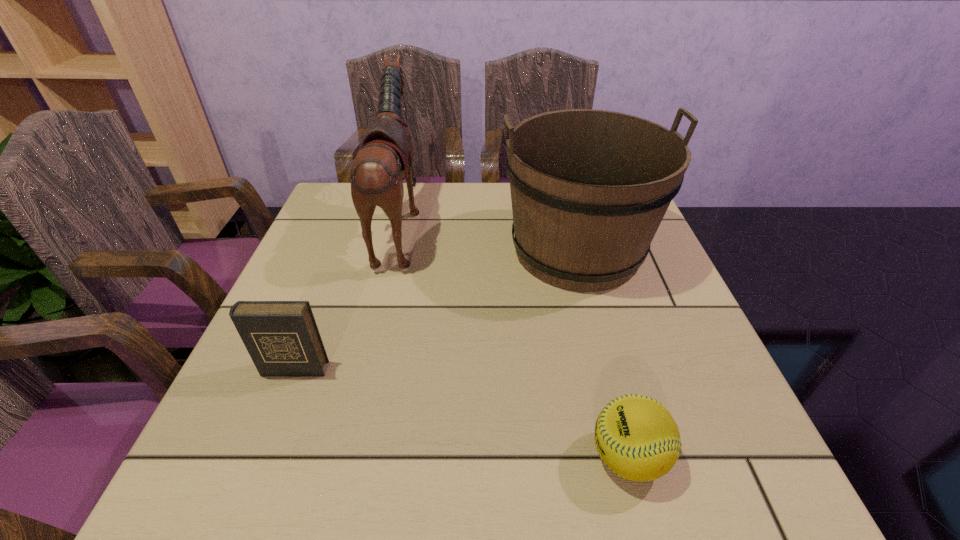
Where is `vacant space at the far edge`? This screenshot has width=960, height=540. vacant space at the far edge is located at coordinates (468, 201).

Identify the location of vacant space at the near edge of the desktop. The image size is (960, 540). point(493,481).

This screenshot has height=540, width=960. I want to click on vacant space at the left edge of the desktop, so 355,257.

Identify the location of vacant area at the right edge. (703, 355).

You are a GUI agent. You are given a task and a screenshot of the screen. Output one action in this format:
    pyautogui.click(x=<x>, y=<y>)
    Task: Click on the vacant position at the far left corner of the desktop
    The height and width of the screenshot is (540, 960).
    Given the screenshot: What is the action you would take?
    pyautogui.click(x=356, y=218)

The height and width of the screenshot is (540, 960). Find the location of `vacant point located between the nearest object and the saddle`. vacant point located between the nearest object and the saddle is located at coordinates (514, 341).

Where is `vacant area that lies between the second shortest object and the saddle`? This screenshot has height=540, width=960. vacant area that lies between the second shortest object and the saddle is located at coordinates (347, 297).

Locate an element on the screen. vacant point located between the bucket and the saddle is located at coordinates (489, 238).

At what (x,y) coordinates should I click in order to perform the action: click on vacant area that lies between the saddle and the third farthest object. Please return your answer as a coordinate pair (x, y). Looking at the image, I should click on (347, 297).

The height and width of the screenshot is (540, 960). I want to click on free space between the diary and the softball, so point(461,413).